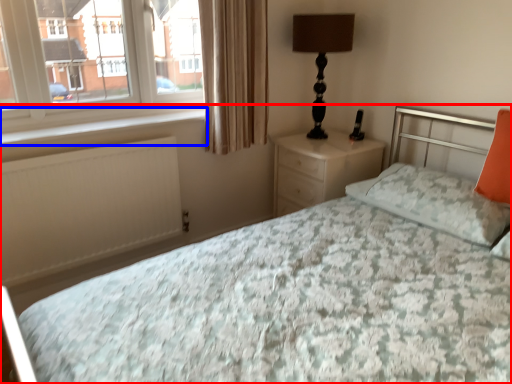
Question: Which object is closer to the camera taking this photo, bed (highlighted by a red box) or window sill (highlighted by a blue box)?

Choices:
 (A) bed
 (B) window sill

Answer: (A)